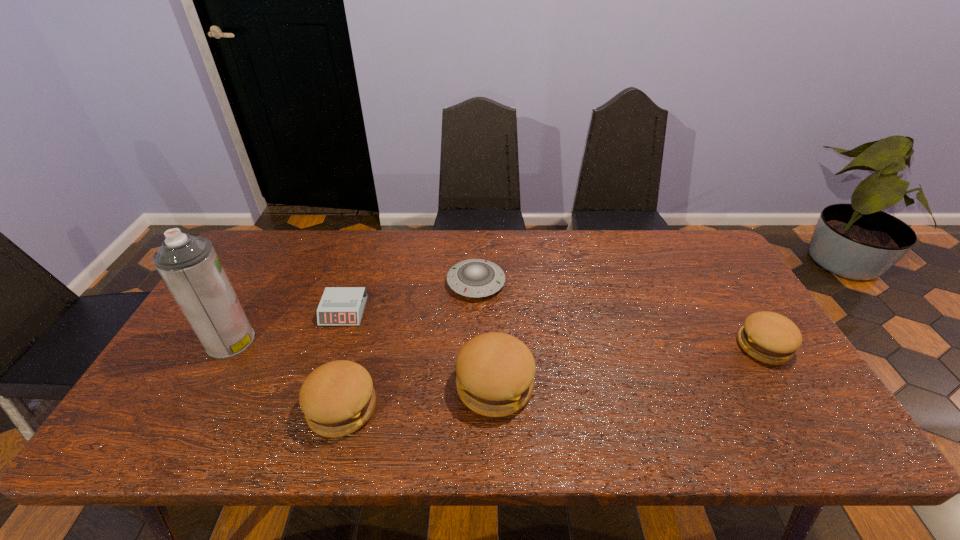
The width and height of the screenshot is (960, 540). I want to click on the second shortest hamburger, so click(x=337, y=398).

Identify the location of the fourth shortest object. (337, 398).

Locate an element on the screen. the second hamburger from right to left is located at coordinates (495, 371).

Locate an element on the screen. Image resolution: width=960 pixels, height=540 pixels. the fourth tallest object is located at coordinates (769, 337).

This screenshot has height=540, width=960. In order to click on the rightmost hamburger in this screenshot , I will do `click(769, 337)`.

Where is `the tallest object`? the tallest object is located at coordinates (189, 265).

Find the location of a particular element. The image size is (960, 540). the leftmost object is located at coordinates (189, 265).

Where is `saucer`? The image size is (960, 540). saucer is located at coordinates click(x=475, y=278).

Where is `alarm clock`? The width and height of the screenshot is (960, 540). alarm clock is located at coordinates (340, 306).

Find the location of a particular element. The height and width of the screenshot is (540, 960). free space located on the right of the leftmost hamburger is located at coordinates (547, 408).